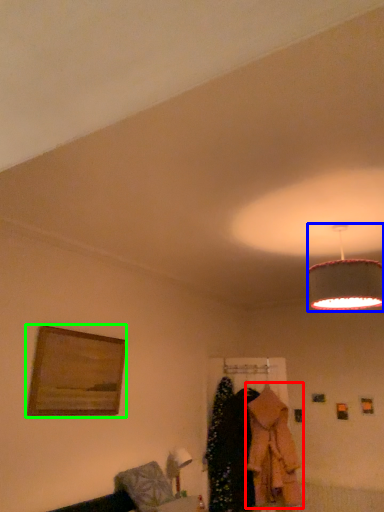
Question: Which is farther away from clothing (highlighted by a red box)? lamp (highlighted by a blue box) or picture frame (highlighted by a green box)?

Choices:
 (A) lamp
 (B) picture frame

Answer: (A)